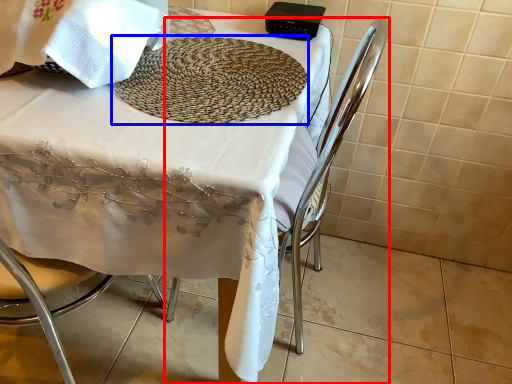
Question: Among these objects, which one is nearest to the camera, chair (highlighted by a red box) or mat (highlighted by a blue box)?

Choices:
 (A) chair
 (B) mat

Answer: (A)